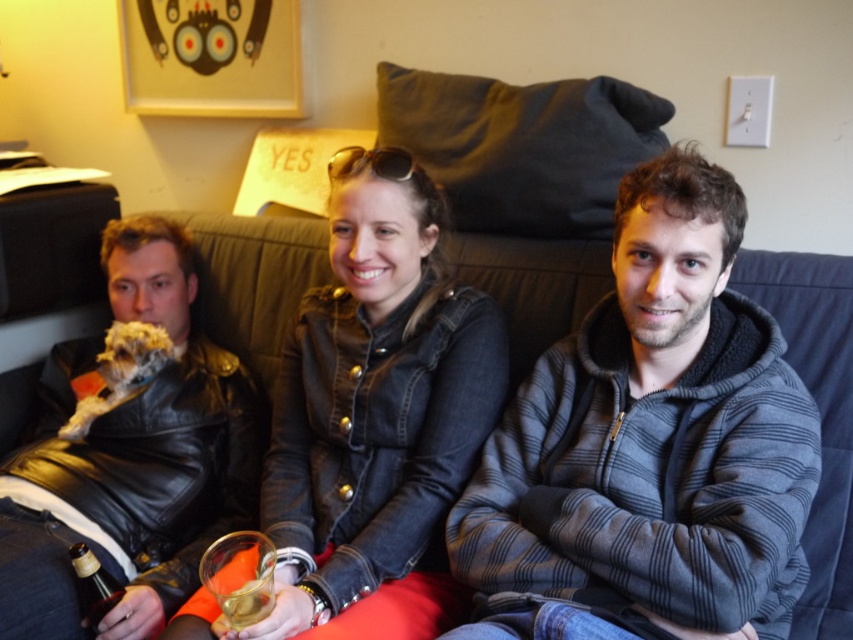
Question: Can you confirm if denim jacket at center is positioned above fluffy white dog at left?

Choices:
 (A) no
 (B) yes

Answer: (A)

Question: Can you confirm if gray striped hoodie at center is smaller than fluffy white dog at left?

Choices:
 (A) no
 (B) yes

Answer: (A)

Question: Which object is positioned farthest from the leather jacket at left?

Choices:
 (A) gray striped hoodie at center
 (B) fluffy white dog at left

Answer: (A)

Question: Among these objects, which one is farthest from the camera?

Choices:
 (A) gray striped hoodie at center
 (B) fluffy white dog at left
 (C) denim jacket at center
 (D) leather jacket at left

Answer: (B)

Question: Does leather jacket at left have a smaller size compared to fluffy white dog at left?

Choices:
 (A) yes
 (B) no

Answer: (B)

Question: Estimate the real-world distances between objects in this image. Which object is farther from the leather jacket at left?

Choices:
 (A) fluffy white dog at left
 (B) denim jacket at center

Answer: (B)